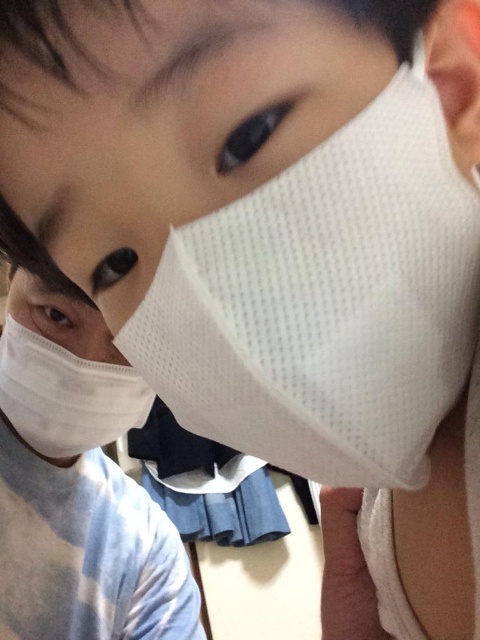
You are a healthcare worker checking the inventory of masks. You have a storage box that can only fit items smaller than the white mesh nose at center. Can the white mesh mask at center be stored in this box?

The white mesh mask at center is bigger than the white mesh nose at center. Therefore, the white mesh mask at center cannot be stored in the box since it exceeds the size limit set by the white mesh nose at center.

In the scene shown: You are standing in a room and see two points marked in the image. The first point is at coordinate point (108, 330) and the second point is at coordinate point (105, 330). Which point is closer to you?

Point (108, 330) is further to the camera than point (105, 330), so the point closer to you is point (105, 330).

You are designing a display for a mask exhibit and need to arrange two items. You have a white mesh mask at left and a white mesh nose at center. The display requires knowing which item is wider. Which one should you place in the wider slot?

The white mesh mask at left is wider than the white mesh nose at center, so you should place the white mesh mask at left in the wider slot.